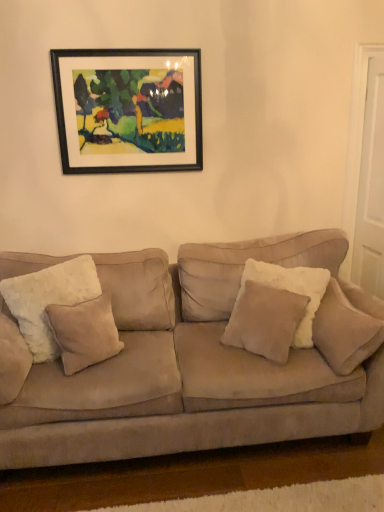
Question: Can you confirm if beige suede couch at center is wider than white fluffy pillow at left, placed as the 1th pillow when sorted from left to right?

Choices:
 (A) yes
 (B) no

Answer: (A)

Question: From the image's perspective, would you say beige suede couch at center is positioned over white fluffy pillow at left, placed as the 1th pillow when sorted from left to right?

Choices:
 (A) yes
 (B) no

Answer: (B)

Question: Can you confirm if beige suede couch at center is smaller than white fluffy pillow at left, positioned as the fourth pillow in right-to-left order?

Choices:
 (A) no
 (B) yes

Answer: (A)

Question: Are beige suede couch at center and white fluffy pillow at left, placed as the 1th pillow when sorted from left to right, located far from each other?

Choices:
 (A) yes
 (B) no

Answer: (B)

Question: Is beige suede couch at center aimed at white fluffy pillow at left, positioned as the fourth pillow in right-to-left order?

Choices:
 (A) no
 (B) yes

Answer: (B)

Question: Considering the relative positions of beige suede couch at center and white fluffy pillow at left, placed as the 1th pillow when sorted from left to right, in the image provided, is beige suede couch at center to the right of white fluffy pillow at left, placed as the 1th pillow when sorted from left to right, from the viewer's perspective?

Choices:
 (A) no
 (B) yes

Answer: (B)

Question: Does beige suede pillow at center, which is the 3th pillow from left to right, have a smaller size compared to beige suede couch at center?

Choices:
 (A) yes
 (B) no

Answer: (A)

Question: Considering the relative sizes of beige suede pillow at center, the second pillow when ordered from right to left, and beige suede couch at center in the image provided, is beige suede pillow at center, the second pillow when ordered from right to left, shorter than beige suede couch at center?

Choices:
 (A) yes
 (B) no

Answer: (A)

Question: From a real-world perspective, is beige suede pillow at center, the second pillow when ordered from right to left, physically above beige suede couch at center?

Choices:
 (A) no
 (B) yes

Answer: (B)

Question: Would you consider beige suede pillow at center, the second pillow when ordered from right to left, to be distant from beige suede couch at center?

Choices:
 (A) yes
 (B) no

Answer: (B)

Question: Considering the relative sizes of beige suede pillow at center, the second pillow when ordered from right to left, and beige suede couch at center in the image provided, is beige suede pillow at center, the second pillow when ordered from right to left, thinner than beige suede couch at center?

Choices:
 (A) yes
 (B) no

Answer: (A)

Question: Is beige suede pillow at center, the second pillow when ordered from right to left, bigger than beige suede couch at center?

Choices:
 (A) yes
 (B) no

Answer: (B)

Question: From a real-world perspective, is beige suede pillow at center, which is the 3th pillow from left to right, physically above white fluffy pillow at left, positioned as the fourth pillow in right-to-left order?

Choices:
 (A) no
 (B) yes

Answer: (A)